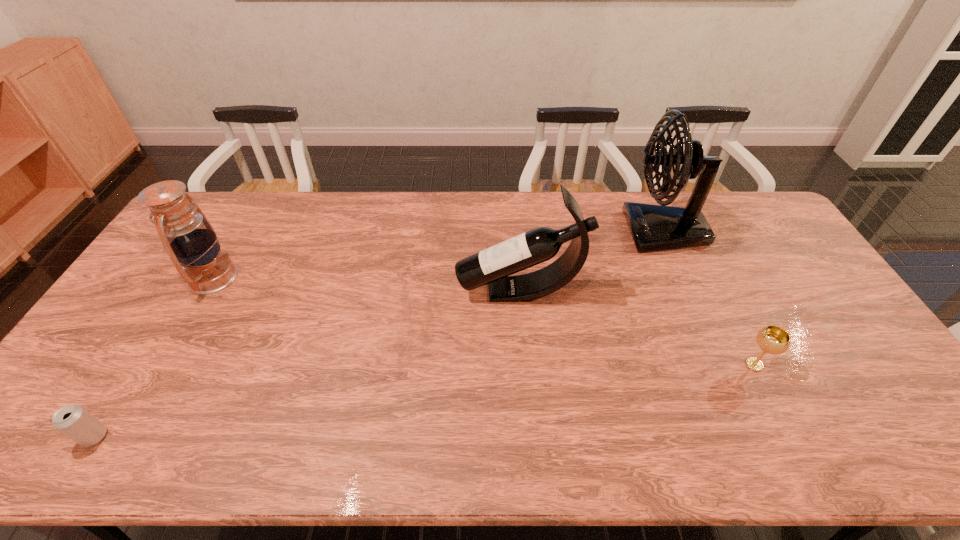
At what (x,y) coordinates should I click in order to perform the action: click on vacant space located 0.390m on the stand of the wine bottle. Please return your answer as a coordinate pair (x, y). Image resolution: width=960 pixels, height=540 pixels. Looking at the image, I should click on (327, 291).

I want to click on blank area located 0.270m on the stand of the wine bottle, so click(x=367, y=291).

Image resolution: width=960 pixels, height=540 pixels. Find the location of `free space located 0.380m on the stand of the wine bottle`. free space located 0.380m on the stand of the wine bottle is located at coordinates (330, 291).

Locate an element on the screen. blank space located on the front of the oil lamp is located at coordinates (138, 404).

Identify the location of free region located 0.260m on the left of the fourth farthest object. This screenshot has height=540, width=960. (641, 364).

This screenshot has width=960, height=540. Find the location of `vacant space located on the back of the nearest object`. vacant space located on the back of the nearest object is located at coordinates pyautogui.click(x=173, y=310).

The image size is (960, 540). I want to click on object present at the far edge, so click(653, 227).

Identify the location of object that is at the near edge. (76, 423).

In order to click on oil lamp situated at the left edge in this screenshot , I will do `click(190, 241)`.

I want to click on beer can situated at the left edge, so click(76, 423).